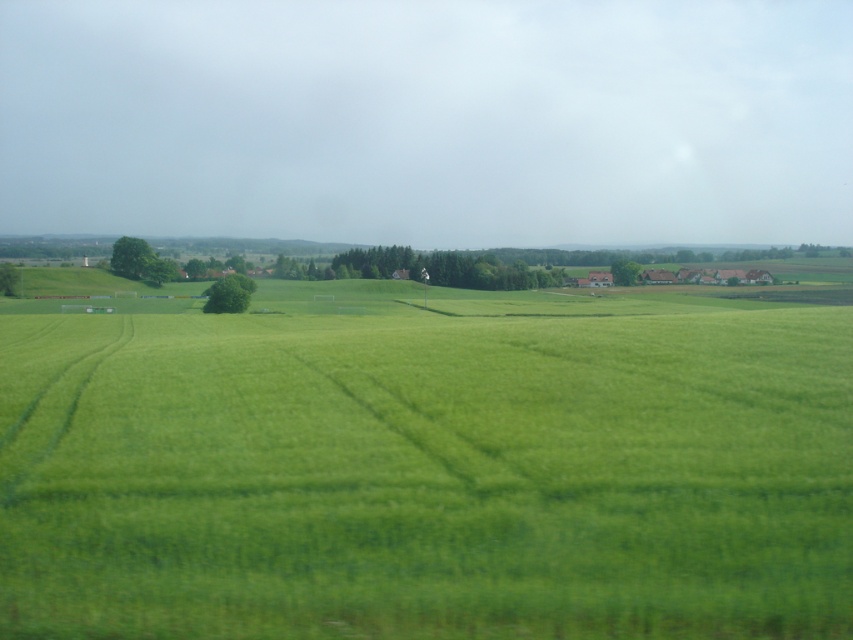
Which is behind, point (633, 262) or point (15, 278)?

Positioned behind is point (633, 262).

This screenshot has height=640, width=853. I want to click on green leafy tree at center-right, so click(x=625, y=272).

Identify the location of green leafy tree at center-right. The width and height of the screenshot is (853, 640). (625, 272).

Does point (238, 296) come closer to viewer compared to point (0, 268)?

Yes, point (238, 296) is closer to viewer.

Describe the element at coordinates (229, 292) in the screenshot. I see `green leafy tree at center` at that location.

Where is `green leafy tree at center`? The height and width of the screenshot is (640, 853). green leafy tree at center is located at coordinates (229, 292).

Between green leafy tree at center and green leafy tree at center-right, which one has less height?

Standing shorter between the two is green leafy tree at center.

Is point (247, 301) less distant than point (630, 276)?

Yes, point (247, 301) is closer to viewer.

Identify the location of green leafy tree at center. (229, 292).